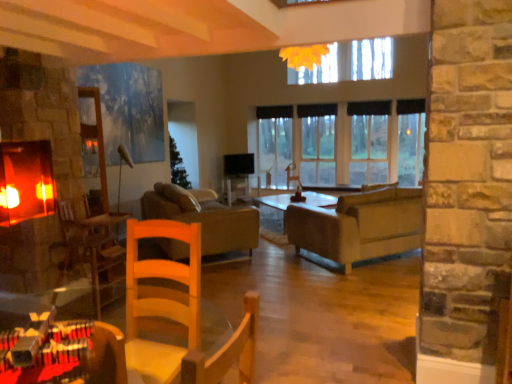
Question: From a real-world perspective, is brown leather couch at center, the second studio couch positioned from the right, positioned above or below clear glass window at center?

Choices:
 (A) above
 (B) below

Answer: (B)

Question: In terms of height, does brown leather couch at center, the 1th studio couch in the left-to-right sequence, look taller or shorter compared to clear glass window at center?

Choices:
 (A) tall
 (B) short

Answer: (B)

Question: Which object is the closest to the wooden armchair at left?

Choices:
 (A) wooden table at lower left
 (B) matte gray couch at center, the 2th studio couch positioned from the left
 (C) clear glass window at center
 (D) brown leather couch at center, the 1th studio couch in the left-to-right sequence

Answer: (D)

Question: Estimate the real-world distances between objects in this image. Which object is closer to the wooden table at lower left?

Choices:
 (A) brown leather couch at center, the 1th studio couch in the left-to-right sequence
 (B) clear glass window at center
 (C) wooden armchair at left
 (D) matte gray couch at center, which is counted as the first studio couch, starting from the right

Answer: (C)